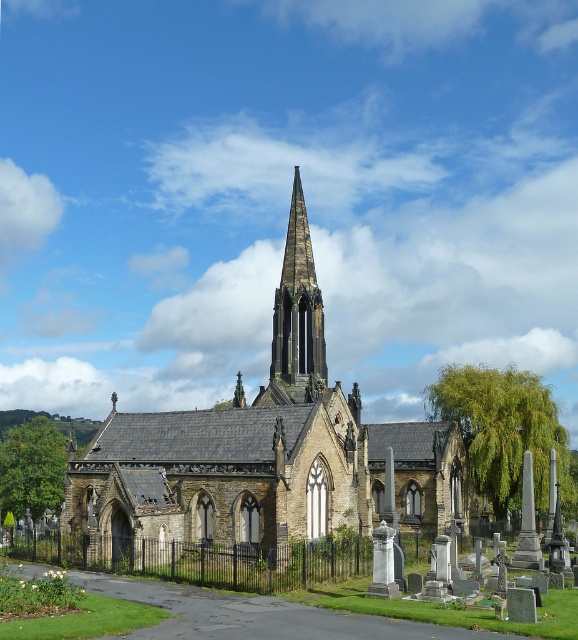
Question: Does brown stone church at center lie in front of smooth stone spire at center?

Choices:
 (A) yes
 (B) no

Answer: (A)

Question: Which point is farther from the camera taking this photo?

Choices:
 (A) (316, 316)
 (B) (187, 486)

Answer: (A)

Question: Which object appears farthest from the camera in this image?

Choices:
 (A) smooth stone spire at center
 (B) brown stone church at center

Answer: (A)

Question: Which point appears farthest from the camera in this image?

Choices:
 (A) (277, 314)
 (B) (275, 374)

Answer: (A)

Question: Is brown stone church at center positioned in front of smooth stone spire at center?

Choices:
 (A) yes
 (B) no

Answer: (A)

Question: Where is brown stone church at center located in relation to smooth stone spire at center in the image?

Choices:
 (A) below
 (B) above

Answer: (A)